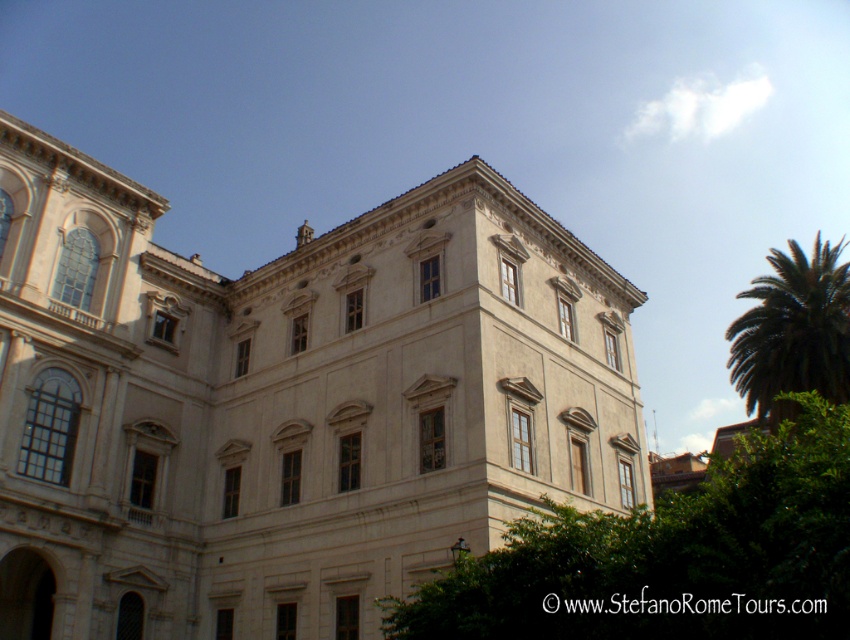
You are standing in front of the grand classical building and want to take a photo of the entire building without any obstructions. The green leafy tree at center is blocking your view. Where should you move to avoid the tree? Please provide coordinates based on the image grid where the tree is located at point 0.869, 0.791.

To avoid the green leafy tree at center blocking your view, you should move to coordinates that are not overlapping with its position. Since the tree is at point (672, 556), moving to a position with a lower x or y coordinate would place you either to the left or above the tree, ensuring it no longer obstructs the view of the building.

You are standing in front of the classical building and want to take a photo of the entire facade. However, there are two trees blocking your view. Which tree is closer to the building, the green leafy tree at center or the green leafy palm at upper right?

The green leafy tree at center is closer to the building than the green leafy palm at upper right because it is positioned under it.